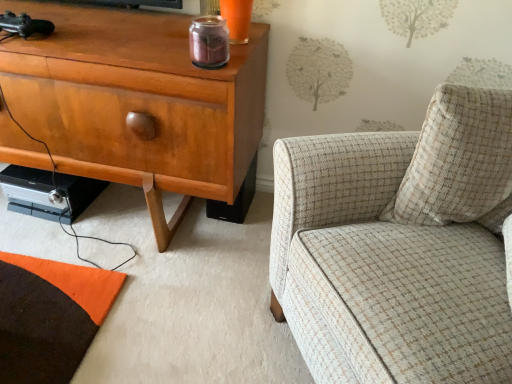
Question: Is matte wood cabinet at left taller or shorter than plaid fabric armchair at right?

Choices:
 (A) short
 (B) tall

Answer: (A)

Question: From the image's perspective, is matte wood cabinet at left positioned above or below plaid fabric armchair at right?

Choices:
 (A) below
 (B) above

Answer: (B)

Question: Which is farther from the beige textured pillow at right?

Choices:
 (A) plaid fabric armchair at right
 (B) matte wood cabinet at left

Answer: (B)

Question: Which object is the closest to the beige textured pillow at right?

Choices:
 (A) plaid fabric armchair at right
 (B) matte wood cabinet at left

Answer: (A)